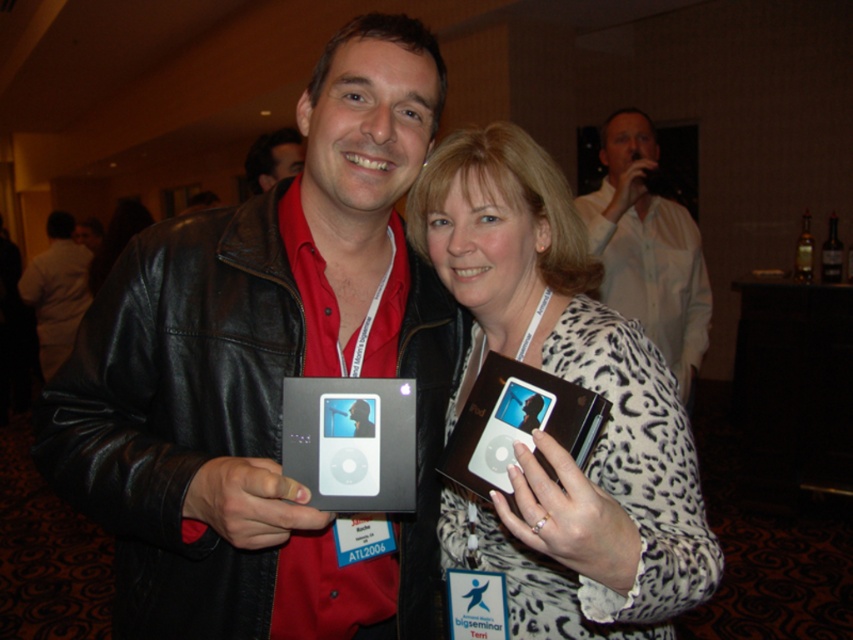
Question: Does black leather jacket at center have a smaller size compared to satin brown ipod at center?

Choices:
 (A) no
 (B) yes

Answer: (A)

Question: Which object is positioned farthest from the dark brown leather jacket at upper center?

Choices:
 (A) black leather jacket at center
 (B) white shirt at upper center

Answer: (A)

Question: Which of the following is the closest to the observer?

Choices:
 (A) (689, 308)
 (B) (554, 289)
 (C) (392, 412)
 (D) (64, 272)

Answer: (C)

Question: Is white shirt at left above dark brown leather jacket at upper center?

Choices:
 (A) no
 (B) yes

Answer: (A)

Question: Is white leopard print shirt at center to the left of white shirt at left from the viewer's perspective?

Choices:
 (A) no
 (B) yes

Answer: (A)

Question: Which object appears farthest from the camera in this image?

Choices:
 (A) black leather jacket at center
 (B) white leopard print shirt at center

Answer: (A)